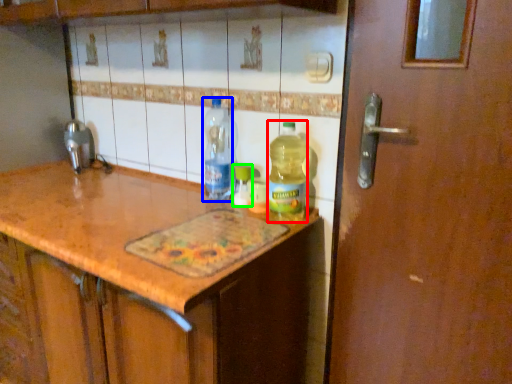
Question: Based on their relative distances, which object is nearer to bottle (highlighted by a red box)? Choose from bottle (highlighted by a blue box) and bottle (highlighted by a green box).

Choices:
 (A) bottle
 (B) bottle

Answer: (B)